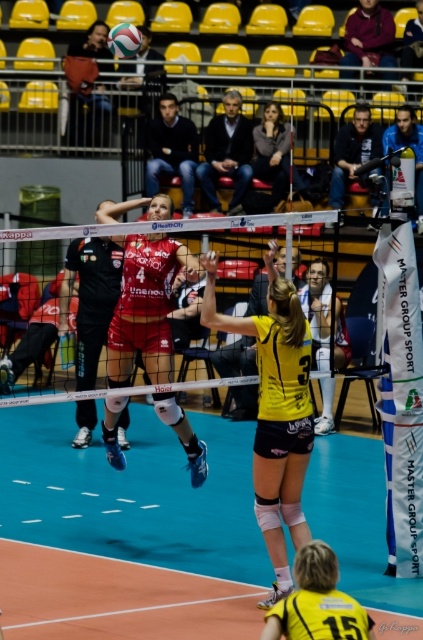
You are a volleyball player preparing to hit the ball. You notice the white mesh net at center and the yellow matte volleyball at upper center. Which object is located to the right of the other?

The yellow matte volleyball at upper center is located to the right of the white mesh net at center.

You are a photographer standing at the side of the court. You want to capture a photo of the matte red volleyball player at center without the dark gray fabric jacket at upper center blocking the view. Based on their widths, can you fit the player into the frame while avoiding the jacket?

The matte red volleyball player at center is wider than the dark gray fabric jacket at upper center, so you can position the camera to include the wider player while excluding the narrower jacket from the frame.